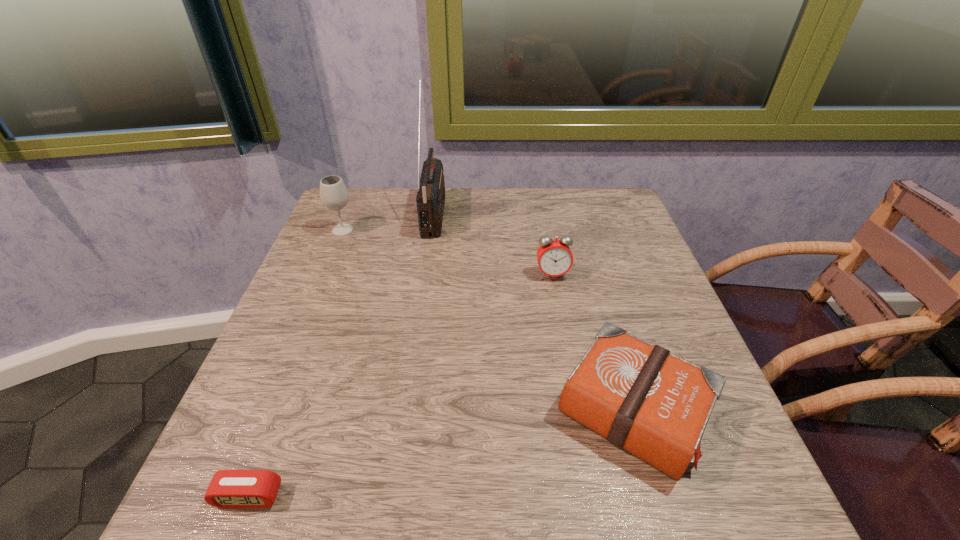
Identify the location of vacant point that satisfies the following two spatial constraints: 1. on the front-facing side of the third nearest object; 2. on the left side of the fourth tallest object. (578, 411).

This screenshot has height=540, width=960. Identify the location of free region that satisfies the following two spatial constraints: 1. on the front-facing side of the tallest object; 2. on the right side of the second shortest object. (406, 411).

You are a GUI agent. You are given a task and a screenshot of the screen. Output one action in this format:
    pyautogui.click(x=<x>, y=<y>)
    Task: Click on the vacant space that satisfies the following two spatial constraints: 1. on the front-facing side of the fourth tallest object; 2. on the right side of the third nearest object
    
    Given the screenshot: What is the action you would take?
    [578, 411]